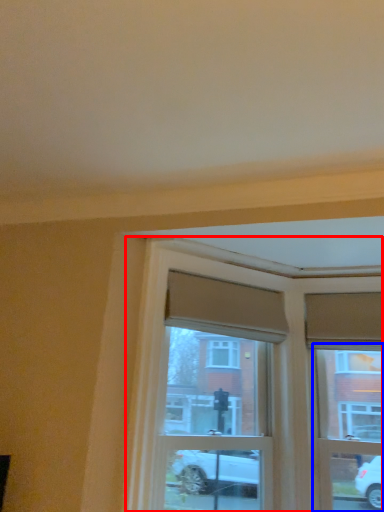
Question: Which of the following is the closest to the observer, window (highlighted by a red box) or window frame (highlighted by a blue box)?

Choices:
 (A) window
 (B) window frame

Answer: (A)